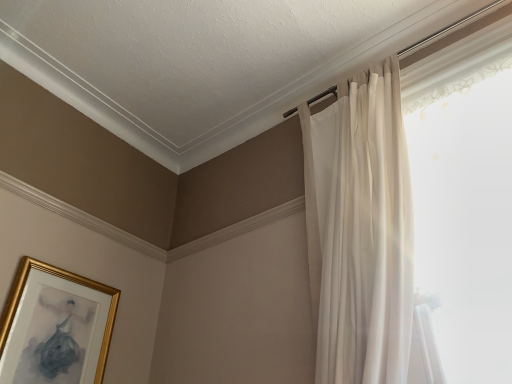
Measure the distance between gold-framed picture at lower left and camera.

gold-framed picture at lower left and camera are 4.84 feet apart.

Identify the location of gold-framed picture at lower left. The width and height of the screenshot is (512, 384). (55, 327).

The image size is (512, 384). What do you see at coordinates (55, 327) in the screenshot? I see `gold-framed picture at lower left` at bounding box center [55, 327].

Locate an element on the screen. sheer white curtain at upper right is located at coordinates (364, 237).

The width and height of the screenshot is (512, 384). What do you see at coordinates (364, 237) in the screenshot? I see `sheer white curtain at upper right` at bounding box center [364, 237].

Where is `gold-framed picture at lower left`? This screenshot has height=384, width=512. gold-framed picture at lower left is located at coordinates [x=55, y=327].

Based on their positions, is gold-framed picture at lower left located to the left or right of sheer white curtain at upper right?

Based on their positions, gold-framed picture at lower left is located to the left of sheer white curtain at upper right.

Is gold-framed picture at lower left in front of sheer white curtain at upper right?

No, the depth of gold-framed picture at lower left is greater than that of sheer white curtain at upper right.

Considering the positions of points (26, 267) and (367, 327), is point (26, 267) farther from camera compared to point (367, 327)?

Yes, point (26, 267) is behind point (367, 327).

From the image's perspective, between gold-framed picture at lower left and sheer white curtain at upper right, which one is located above?

sheer white curtain at upper right is shown above in the image.

From a real-world perspective, does gold-framed picture at lower left stand above sheer white curtain at upper right?

No, from a real-world perspective, gold-framed picture at lower left is not on top of sheer white curtain at upper right.

Does gold-framed picture at lower left have a lesser width compared to sheer white curtain at upper right?

Yes.

Who is taller, gold-framed picture at lower left or sheer white curtain at upper right?

sheer white curtain at upper right.

Which of these two, gold-framed picture at lower left or sheer white curtain at upper right, is smaller?

With smaller size is gold-framed picture at lower left.

Would you say gold-framed picture at lower left is inside or outside sheer white curtain at upper right?

gold-framed picture at lower left is not inside sheer white curtain at upper right, it's outside.

Are gold-framed picture at lower left and sheer white curtain at upper right located far from each other?

Indeed, gold-framed picture at lower left is not near sheer white curtain at upper right.

Is gold-framed picture at lower left oriented towards sheer white curtain at upper right?

Yes, gold-framed picture at lower left faces towards sheer white curtain at upper right.

How distant is gold-framed picture at lower left from sheer white curtain at upper right?

gold-framed picture at lower left is 3.62 feet from sheer white curtain at upper right.

The image size is (512, 384). What are the coordinates of `curtain on the right of the gold-framed picture at lower left` in the screenshot? It's located at (364, 237).

Can you confirm if sheer white curtain at upper right is positioned to the right of gold-framed picture at lower left?

Correct, you'll find sheer white curtain at upper right to the right of gold-framed picture at lower left.

Is the position of sheer white curtain at upper right more distant than that of gold-framed picture at lower left?

That is False.

Which is farther, (414, 338) or (16, 357)?

Point (16, 357)

From the image's perspective, does sheer white curtain at upper right appear lower than gold-framed picture at lower left?

No.

From a real-world perspective, is sheer white curtain at upper right on top of gold-framed picture at lower left?

Yes.

Is sheer white curtain at upper right wider than gold-framed picture at lower left?

Correct, the width of sheer white curtain at upper right exceeds that of gold-framed picture at lower left.

From their relative heights in the image, would you say sheer white curtain at upper right is taller or shorter than gold-framed picture at lower left?

Considering their sizes, sheer white curtain at upper right has more height than gold-framed picture at lower left.

Based on their sizes in the image, would you say sheer white curtain at upper right is bigger or smaller than gold-framed picture at lower left?

In the image, sheer white curtain at upper right appears to be larger than gold-framed picture at lower left.

Can we say sheer white curtain at upper right lies outside gold-framed picture at lower left?

Indeed, sheer white curtain at upper right is completely outside gold-framed picture at lower left.

Are sheer white curtain at upper right and gold-framed picture at lower left located far from each other?

Yes.

Is sheer white curtain at upper right aimed at gold-framed picture at lower left?

No, sheer white curtain at upper right is not turned towards gold-framed picture at lower left.

Can you tell me how much sheer white curtain at upper right and gold-framed picture at lower left differ in facing direction?

89.8 degrees.

In order to click on picture frame that is below the sheer white curtain at upper right (from the image's perspective) in this screenshot , I will do `click(55, 327)`.

You are a GUI agent. You are given a task and a screenshot of the screen. Output one action in this format:
    pyautogui.click(x=<x>, y=<y>)
    Task: Click on the curtain on the right of gold-framed picture at lower left
    This screenshot has width=512, height=384.
    Given the screenshot: What is the action you would take?
    pyautogui.click(x=364, y=237)

Identify the location of curtain that is above the gold-framed picture at lower left (from the image's perspective). This screenshot has height=384, width=512. (364, 237).